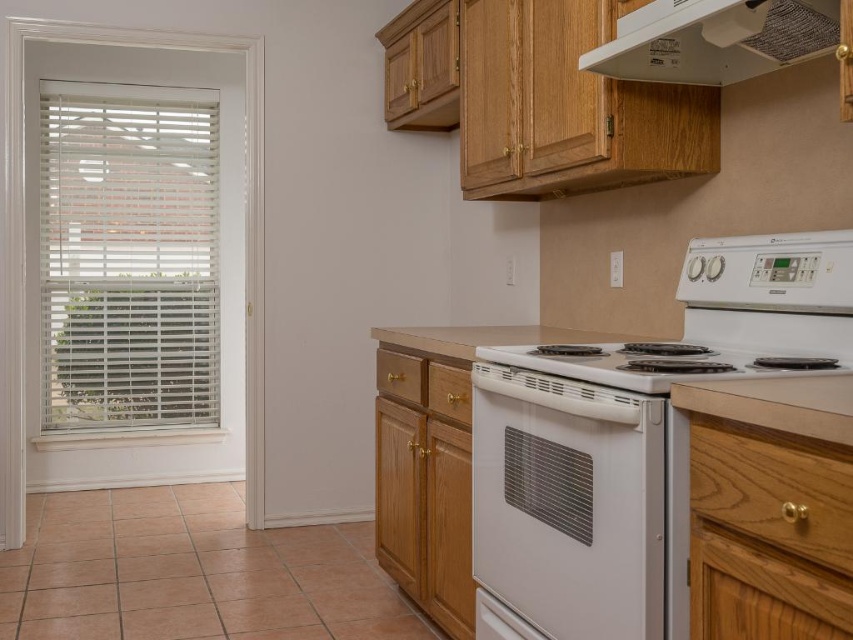
You are standing in the kitchen and want to reach both the point at coordinates (531, 516) and the point at coordinates (630, 22). Which point will require you to stretch further to reach?

The point at coordinates (630, 22) will require stretching further because it is farther from you compared to the point at coordinates (531, 516), which is closer.

In the kitchen scene described, where is the white glossy oven at center positioned relative to the white textured exhaust hood at upper center?

The white glossy oven at center is located below the white textured exhaust hood at upper center.

You are a delivery person who just arrived at the kitchen to place a new microwave. The kitchen has a white glossy electric stove at center right. The delivery instructions say to place the microwave on the countertop as close as possible to the stove. Where should you place the microwave?

The white glossy electric stove at center right is located at coordinates [631,440]. To place the microwave as close as possible to the stove, position it near those coordinates on the countertop.